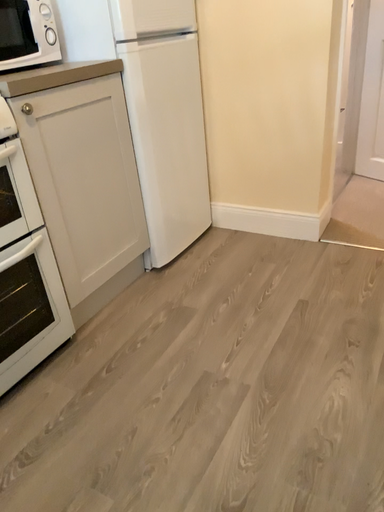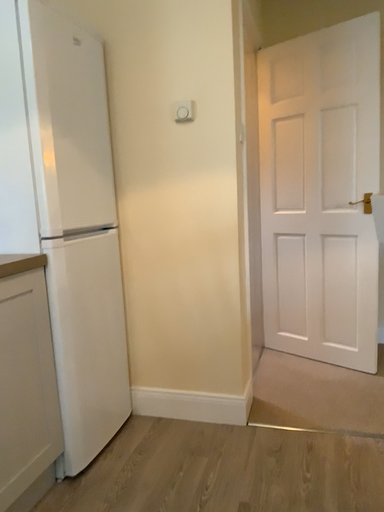
Question: Which way did the camera rotate in the video?

Choices:
 (A) rotated downward
 (B) rotated upward

Answer: (B)